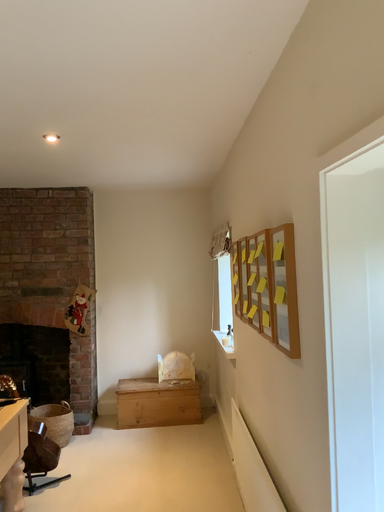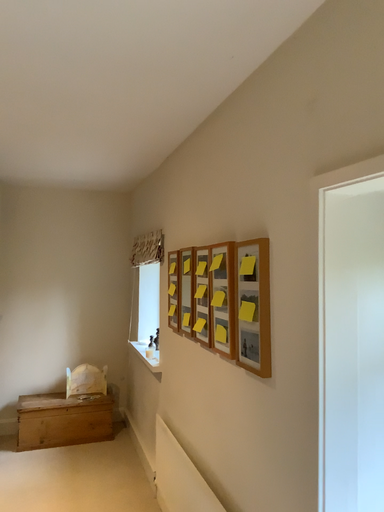
Question: Which way did the camera rotate in the video?

Choices:
 (A) rotated left
 (B) rotated right

Answer: (B)